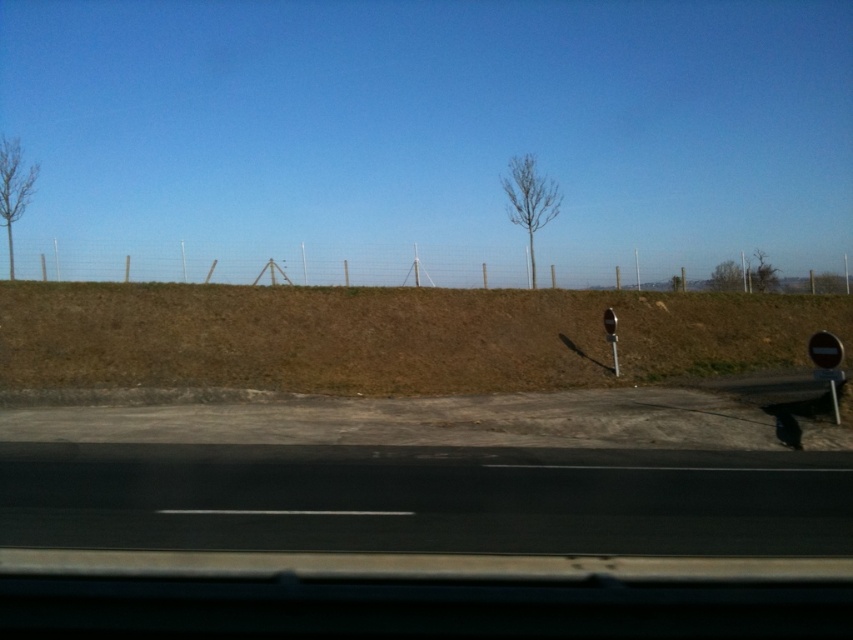
Question: Does bare branches at upper right appear under green leafy tree at center?

Choices:
 (A) no
 (B) yes

Answer: (A)

Question: Can you confirm if black asphalt highway at lower center is positioned below bare branches at left?

Choices:
 (A) no
 (B) yes

Answer: (B)

Question: Among these objects, which one is nearest to the camera?

Choices:
 (A) bare branches at left
 (B) bare branches at upper right

Answer: (A)

Question: Is bare wood tree at center to the right of bare branches at left from the viewer's perspective?

Choices:
 (A) no
 (B) yes

Answer: (B)

Question: Which point is farther to the camera?

Choices:
 (A) bare wood tree at center
 (B) green leafy tree at center

Answer: (B)

Question: Among these objects, which one is nearest to the camera?

Choices:
 (A) black asphalt highway at lower center
 (B) bare branches at left
 (C) bare branches at upper right
 (D) bare wood tree at center

Answer: (A)